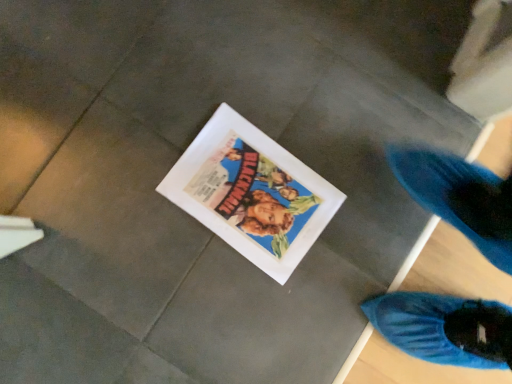
At what (x,y) coordinates should I click in order to perform the action: click on vacant region above matte paper comic book at center (from a real-world perspective). Please return your answer as a coordinate pair (x, y). Looking at the image, I should click on (253, 191).